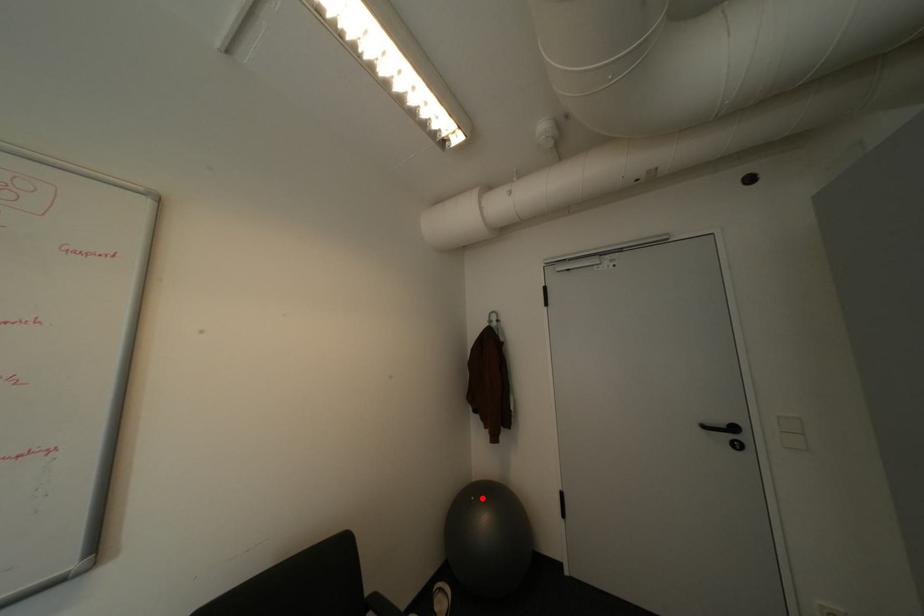
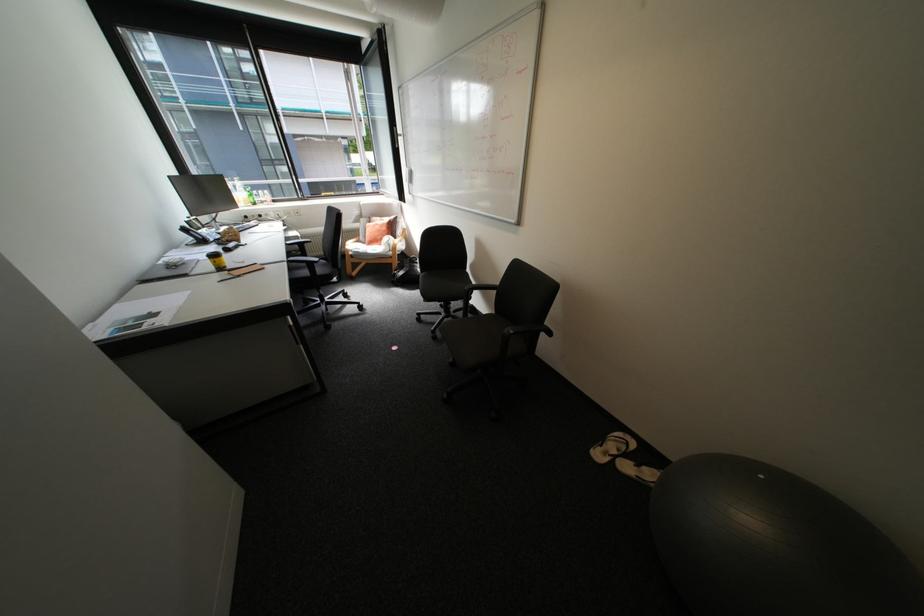
Question: A red point is marked in image1. In image2, is the corresponding 3D point closer to the camera or farther? Reply with the corresponding letter.

Choices:
 (A) The corresponding 3D point is closer.
 (B) The corresponding 3D point is farther.

Answer: (B)